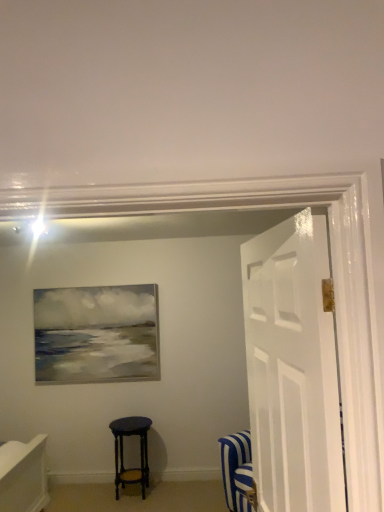
Question: From the image's perspective, is matte black stool at center over white glossy door at right?

Choices:
 (A) no
 (B) yes

Answer: (A)

Question: Is matte black stool at center positioned with its back to white glossy door at right?

Choices:
 (A) yes
 (B) no

Answer: (B)

Question: Does matte black stool at center lie behind white glossy door at right?

Choices:
 (A) yes
 (B) no

Answer: (A)

Question: Does matte black stool at center have a smaller size compared to white glossy door at right?

Choices:
 (A) no
 (B) yes

Answer: (B)

Question: From a real-world perspective, is matte black stool at center located higher than white glossy door at right?

Choices:
 (A) no
 (B) yes

Answer: (A)

Question: From a real-world perspective, is matte black stool at center physically below white glossy door at right?

Choices:
 (A) no
 (B) yes

Answer: (B)

Question: Is white glossy door at right shorter than matte black stool at center?

Choices:
 (A) no
 (B) yes

Answer: (A)

Question: Considering the relative sizes of white glossy door at right and matte black stool at center in the image provided, is white glossy door at right wider than matte black stool at center?

Choices:
 (A) no
 (B) yes

Answer: (A)

Question: From the image's perspective, is white glossy door at right on top of matte black stool at center?

Choices:
 (A) no
 (B) yes

Answer: (B)

Question: Is white glossy door at right to the left of matte black stool at center from the viewer's perspective?

Choices:
 (A) yes
 (B) no

Answer: (B)

Question: Does white glossy door at right have a lesser width compared to matte black stool at center?

Choices:
 (A) yes
 (B) no

Answer: (A)

Question: Is white glossy door at right in contact with matte black stool at center?

Choices:
 (A) yes
 (B) no

Answer: (B)

Question: Considering their positions, is matte black stool at center located in front of or behind white glossy door at right?

Choices:
 (A) front
 (B) behind

Answer: (B)